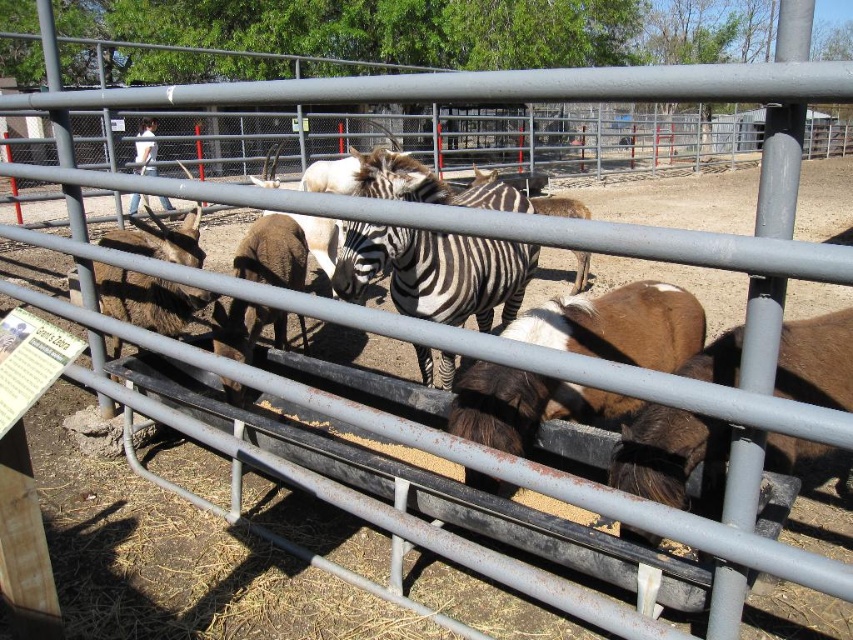
You are a zookeeper trying to feed the animals. You have a small bag of hay. The brown fuzzy goat at center is closer to you than the black and white striped zebra at center. Which animal should you feed first to ensure the hay reaches the closer one?

You should feed the brown fuzzy goat at center first because it is closer to you than the black and white striped zebra at center, so the hay will reach it first.